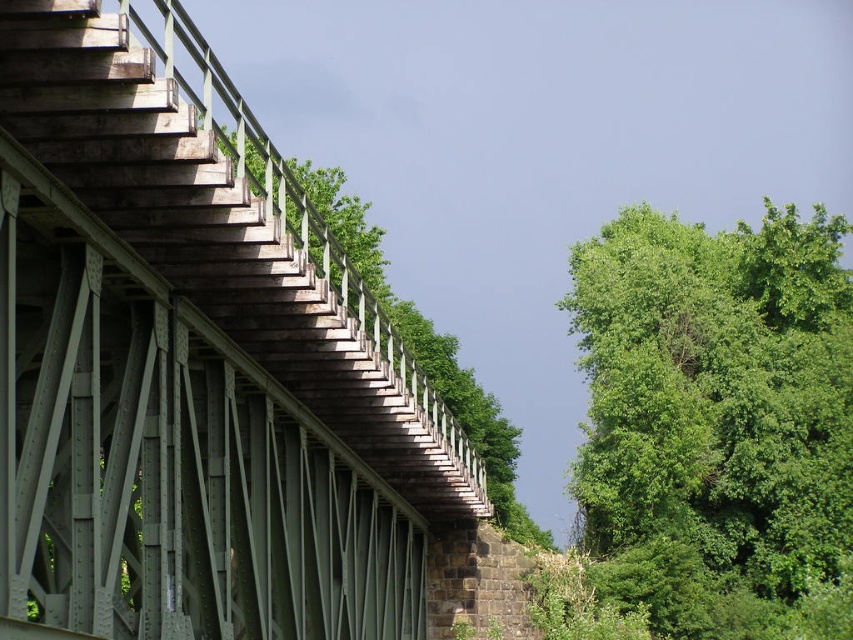
You are standing on the railway bridge and want to take a photo of the green metallic bridge at left and the green leafy tree at right. Which object should you position closer to the left side of the frame to include both in your photo?

You should position the green metallic bridge at left closer to the left side of the frame since it is already to the left of the green leafy tree at right.

You are a painter standing on the ground near the green metallic bridge at left and the green leafy tree at right. You need to paint the highest point of both objects. Which object will require you to climb higher to reach its top?

The green metallic bridge at left has a greater height compared to the green leafy tree at right, so you will need to climb higher to reach the top of the green metallic bridge at left.